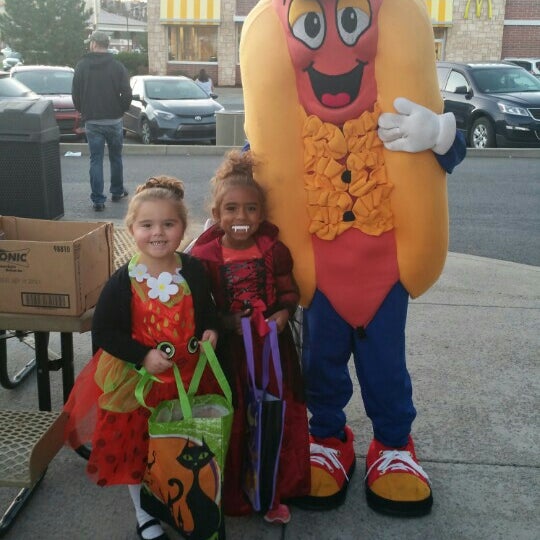
This screenshot has width=540, height=540. Find the location of `cardboard box`. cardboard box is located at coordinates (40, 259).